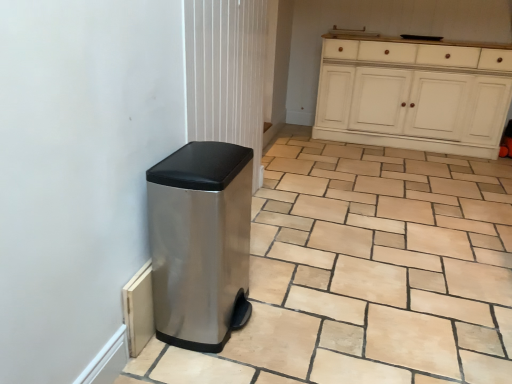
Locate an element on the screen. Image resolution: width=512 pixels, height=384 pixels. free location in front of white painted wood cabinet at upper right is located at coordinates (401, 180).